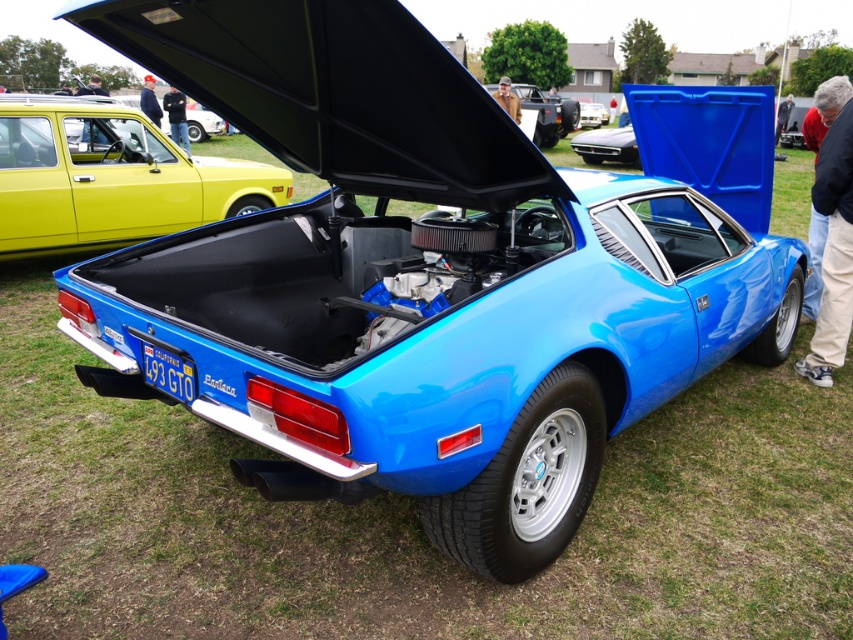
You are a photographer standing in front of the shiny metallic car at center and the shiny black car at center. You want to capture a photo where both cars are fully visible in the frame. Which car should you position closer to the camera to ensure both are fully visible?

You should position the shiny metallic car at center closer to the camera since it has a greater height compared to the shiny black car at center. This way, the taller car will occupy more vertical space, allowing both cars to fit within the frame without cropping either.

You are a parking attendant at a car show. You need to park the yellow matte hatchback at left and the shiny black car at center into two adjacent parking spaces. The parking spaces are exactly the same width. Which car requires a wider space to park?

The yellow matte hatchback at left requires a wider parking space because its width is larger than the shiny black car at center.